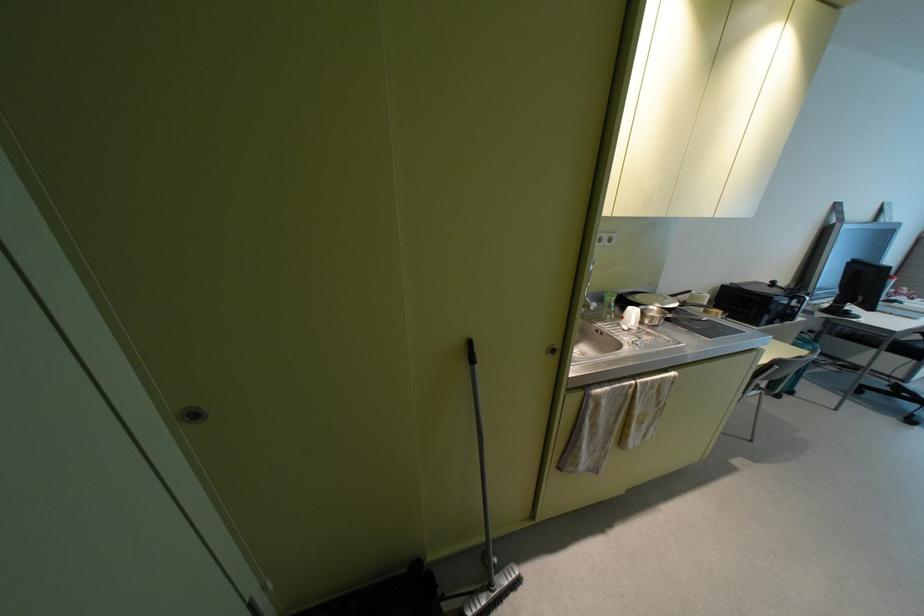
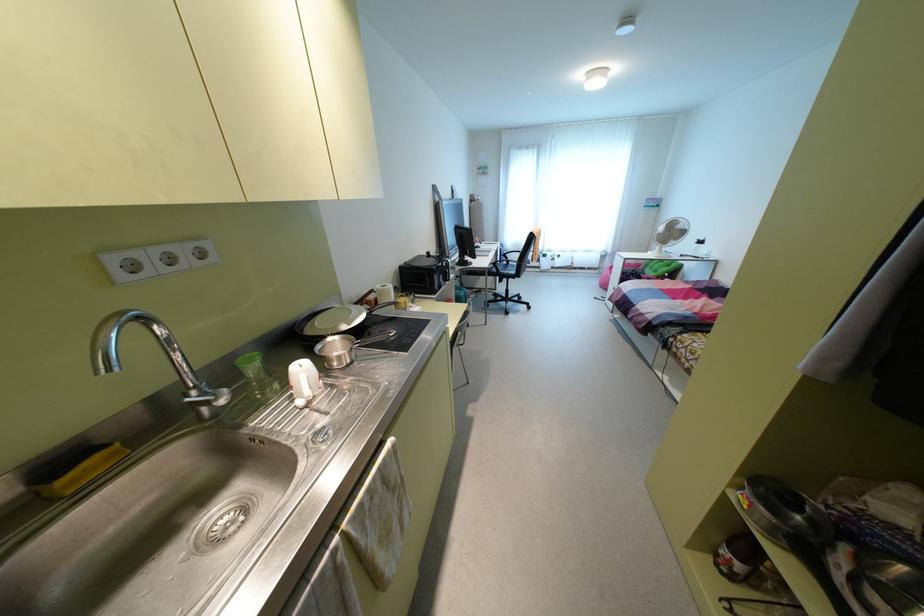
The point at [603,237] is marked in the first image. Where is the corresponding point in the second image?

(181, 251)